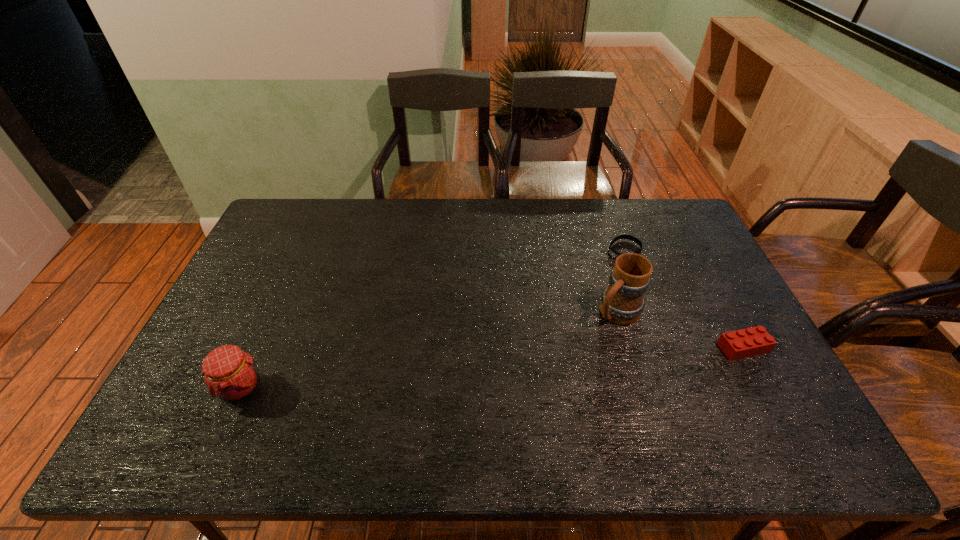
At what (x,y) coordinates should I click in order to perform the action: click on free space that is in between the rightmost object and the farthest object. Please return your answer as a coordinate pair (x, y). The image size is (960, 540). Looking at the image, I should click on (684, 299).

The width and height of the screenshot is (960, 540). I want to click on free space between the third nearest object and the nearest object, so click(x=429, y=350).

In order to click on free spot between the leftmost object and the shortest object in this screenshot , I will do `click(433, 319)`.

Where is `vacant space in between the shortest object and the leftmost object`? vacant space in between the shortest object and the leftmost object is located at coordinates (433, 319).

The width and height of the screenshot is (960, 540). What are the coordinates of `free space between the mug and the rightmost object` in the screenshot? It's located at (680, 330).

Identify which object is the third nearest to the wristband. Please provide its 2D coordinates. Your answer should be formatted as a tuple, i.e. [(x, y)], where the tuple contains the x and y coordinates of a point satisfying the conditions above.

[(230, 374)]

Where is `object that can be found as the third closest to the mug`? Image resolution: width=960 pixels, height=540 pixels. object that can be found as the third closest to the mug is located at coordinates (x=230, y=374).

Identify the location of free region that satisfies the following two spatial constraints: 1. on the front side of the third tallest object; 2. on the left side of the mug. This screenshot has height=540, width=960. (627, 348).

What are the coordinates of `free space in the image that satisfies the following two spatial constraints: 1. on the back side of the wristband; 2. on the right side of the tallest object` in the screenshot? It's located at (598, 250).